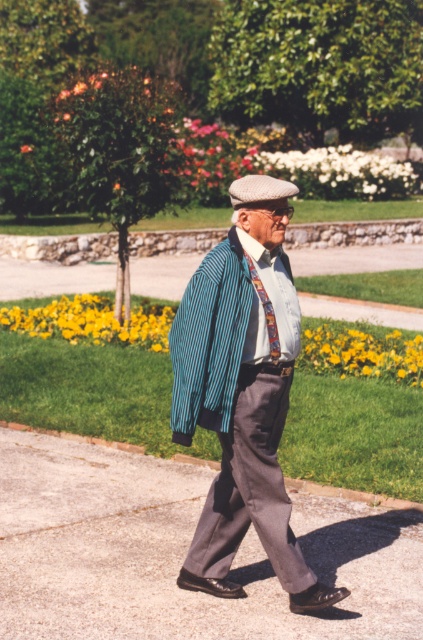
Question: Among these points, which one is nearest to the camera?

Choices:
 (A) (225, 396)
 (B) (260, 349)
 (C) (271, 330)

Answer: (A)

Question: Which object appears farthest from the camera in this image?

Choices:
 (A) gray concrete pavement at lower center
 (B) striped cotton shirt at center
 (C) blue striped shirt at center
 (D) striped wool sweater at center

Answer: (B)

Question: Which object appears farthest from the camera in this image?

Choices:
 (A) striped cotton shirt at center
 (B) blue striped shirt at center
 (C) gray concrete pavement at lower center

Answer: (A)

Question: Is blue striped shirt at center below striped cotton shirt at center?

Choices:
 (A) no
 (B) yes

Answer: (B)

Question: Observing the image, what is the correct spatial positioning of striped wool sweater at center in reference to patterned silk tie at center?

Choices:
 (A) below
 (B) above

Answer: (A)

Question: Can you confirm if striped wool sweater at center is positioned to the left of striped cotton shirt at center?

Choices:
 (A) no
 (B) yes

Answer: (B)